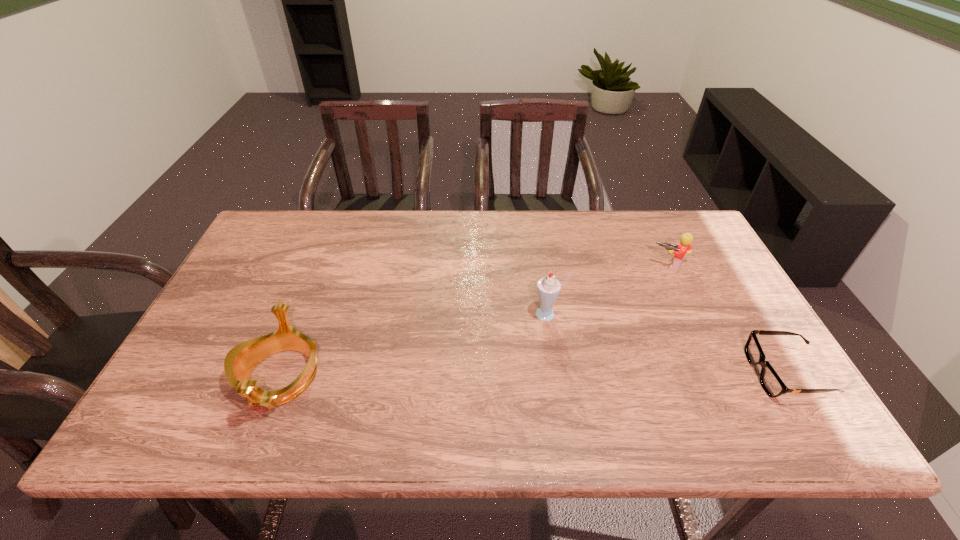
I want to click on free spot on the desktop that is between the leftmost object and the shortest object and is positioned on the straw side of the second farthest object, so click(484, 376).

Where is `vacant space on the desktop that is between the tiara and the rightmost object and is positioned in front of the third object from left to right with the accessory visible`? vacant space on the desktop that is between the tiara and the rightmost object and is positioned in front of the third object from left to right with the accessory visible is located at coordinates (599, 375).